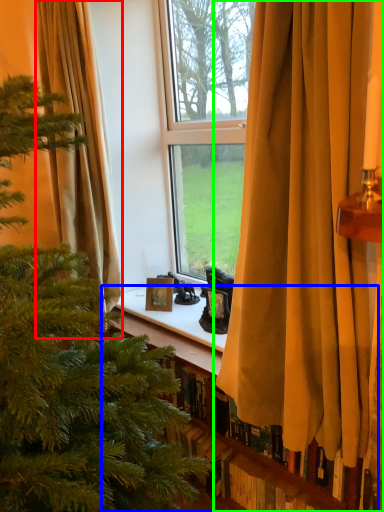
Question: Considering the real-world distances, which object is farthest from curtain (highlighted by a red box)? bookshelf (highlighted by a blue box) or curtain (highlighted by a green box)?

Choices:
 (A) bookshelf
 (B) curtain

Answer: (A)